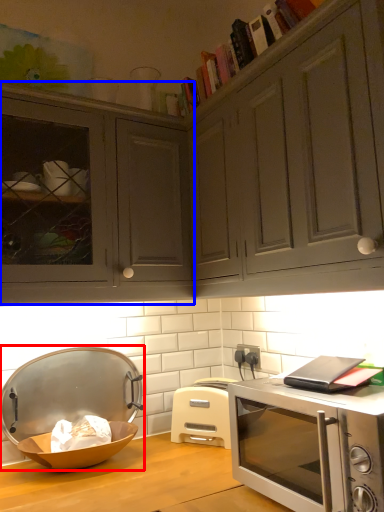
Question: Among these objects, which one is nearest to the camera, appliance (highlighted by a red box) or cabinetry (highlighted by a blue box)?

Choices:
 (A) appliance
 (B) cabinetry

Answer: (B)